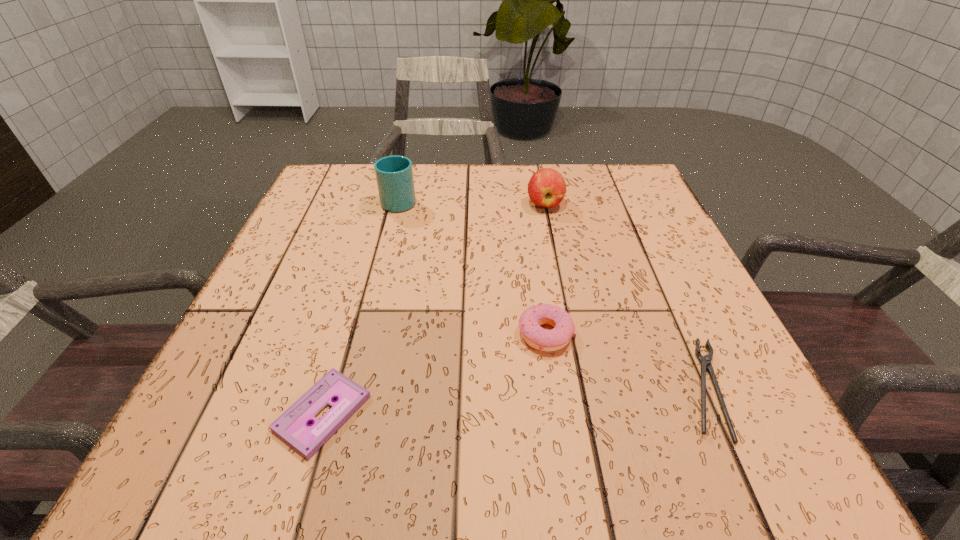
Locate an element on the screen. free spot located 0.170m on the back of the shortest object is located at coordinates (356, 300).

You are a GUI agent. You are given a task and a screenshot of the screen. Output one action in this format:
    pyautogui.click(x=<x>, y=<y>)
    Task: Click on the cup at the far edge
    
    Given the screenshot: What is the action you would take?
    pyautogui.click(x=394, y=174)

Image resolution: width=960 pixels, height=540 pixels. I want to click on apple located at the far edge, so click(x=546, y=188).

Find the location of a particular element. tongs situated at the near edge is located at coordinates (705, 361).

Locate an element on the screen. This screenshot has height=540, width=960. videotape at the near edge is located at coordinates (292, 426).

Image resolution: width=960 pixels, height=540 pixels. Find the location of `object that is positioned at the left edge`. object that is positioned at the left edge is located at coordinates (292, 426).

You are a GUI agent. You are given a task and a screenshot of the screen. Output one action in this format:
    pyautogui.click(x=<x>, y=<y>)
    Task: Click on the object that is positioned at the right edge
    The width and height of the screenshot is (960, 540).
    Given the screenshot: What is the action you would take?
    (x=705, y=361)

Identify the location of object present at the near left corner. The width and height of the screenshot is (960, 540). (292, 426).

Find the location of a particular element. Image resolution: width=960 pixels, height=540 pixels. object that is at the near right corner is located at coordinates (705, 361).

In the image, there is a desktop. Where is `vacant space at the far edge`? vacant space at the far edge is located at coordinates (567, 187).